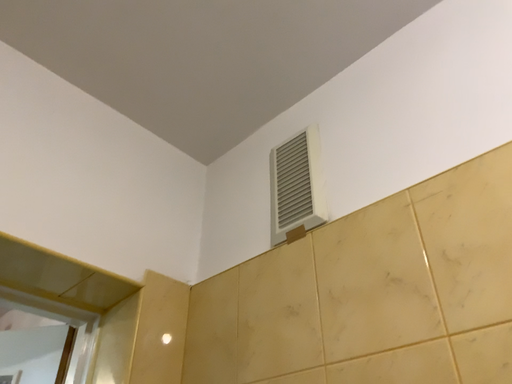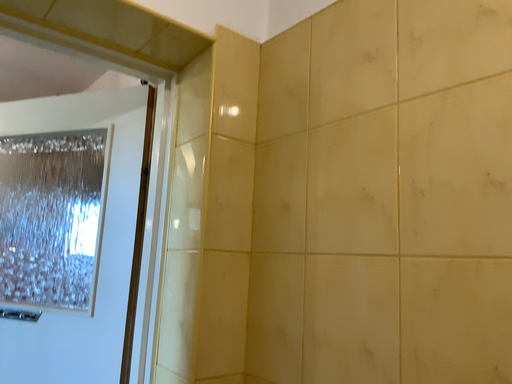
Question: Which way did the camera rotate in the video?

Choices:
 (A) rotated right
 (B) rotated left

Answer: (B)